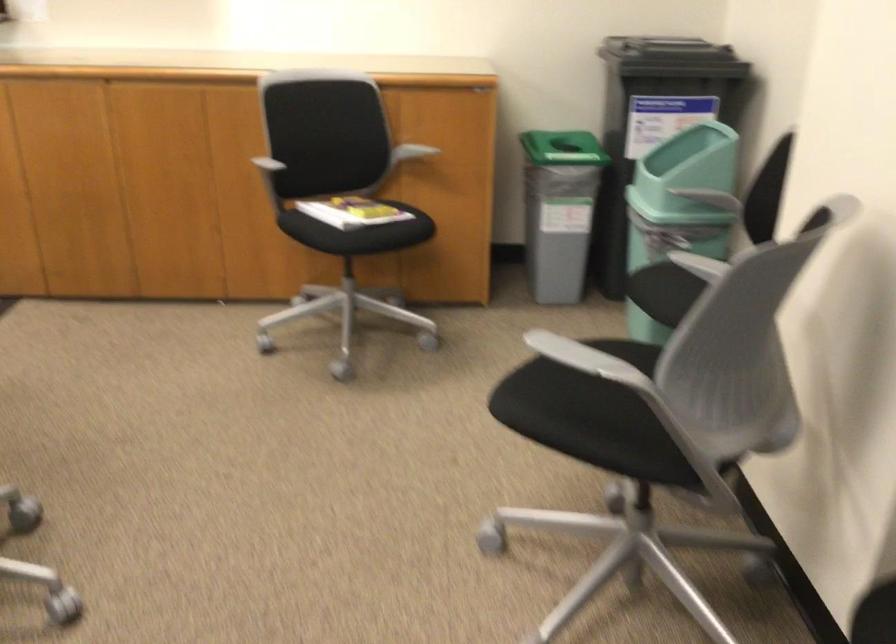
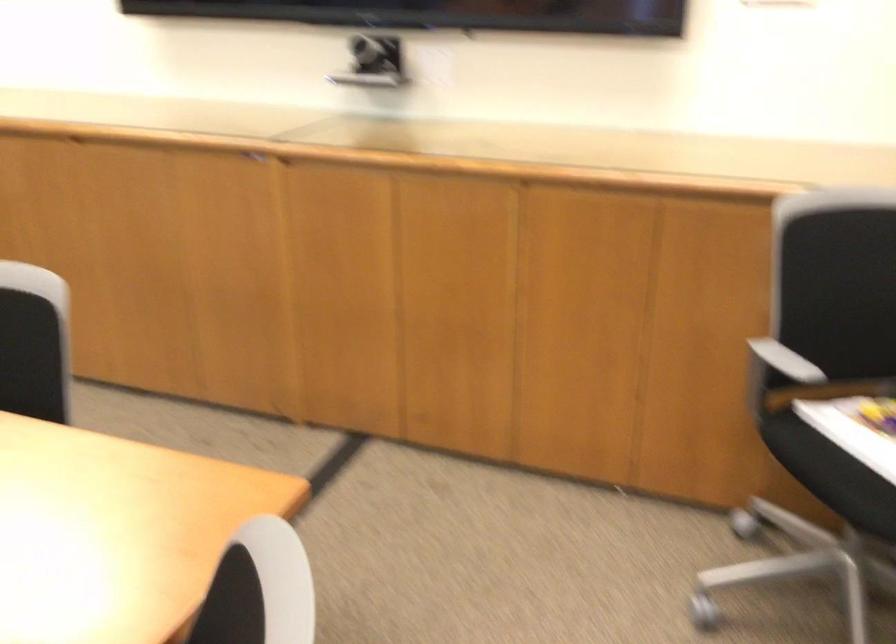
The images are taken continuously from a first-person perspective. In which direction are you moving?

The cameraman moved toward left, forward.